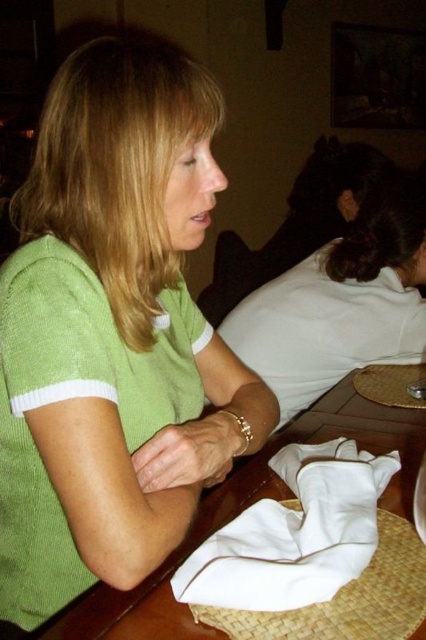
Question: Does green knitted sweater at center appear on the left side of white cotton napkin at lower center?

Choices:
 (A) no
 (B) yes

Answer: (B)

Question: Which of these objects is positioned farthest from the green matte shirt at center?

Choices:
 (A) green knitted sweater at center
 (B) white cotton napkin at lower center

Answer: (B)

Question: Which of the following is the farthest from the observer?

Choices:
 (A) green matte shirt at center
 (B) white cotton napkin at lower center

Answer: (A)

Question: Is green knitted sweater at center smaller than green matte shirt at center?

Choices:
 (A) no
 (B) yes

Answer: (A)

Question: Considering the real-world distances, which object is closest to the white cotton napkin at lower center?

Choices:
 (A) green knitted sweater at center
 (B) green matte shirt at center

Answer: (A)

Question: Considering the relative positions of green knitted sweater at center and green matte shirt at center in the image provided, where is green knitted sweater at center located with respect to green matte shirt at center?

Choices:
 (A) below
 (B) above

Answer: (A)